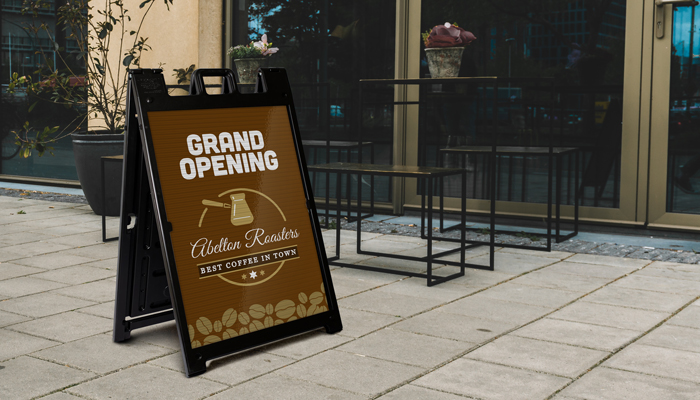
This screenshot has width=700, height=400. Find the location of `table stand`. table stand is located at coordinates (395, 191).